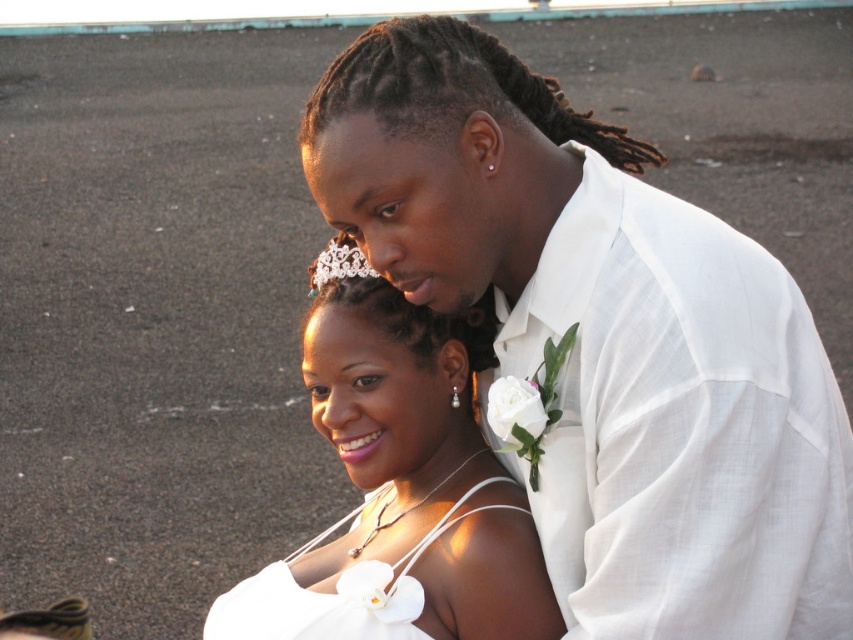
Question: Which of the following is the farthest from the observer?

Choices:
 (A) pearl/textured tiara at upper center
 (B) white sheer shirt at upper right

Answer: (A)

Question: Does white satin dress at lower center appear on the left side of pearl/textured tiara at upper center?

Choices:
 (A) no
 (B) yes

Answer: (A)

Question: Can you confirm if white satin dress at center is positioned to the right of white satin dress at lower center?

Choices:
 (A) yes
 (B) no

Answer: (A)

Question: Which point is closer to the camera?

Choices:
 (A) white satin dress at center
 (B) white satin dress at lower center
 (C) white sheer shirt at upper right
 (D) pearl/textured tiara at upper center

Answer: (C)

Question: Does white sheer shirt at upper right appear under white satin dress at lower center?

Choices:
 (A) yes
 (B) no

Answer: (B)

Question: Which object appears farthest from the camera in this image?

Choices:
 (A) white satin dress at lower center
 (B) white sheer shirt at upper right
 (C) white satin dress at center
 (D) pearl/textured tiara at upper center

Answer: (D)